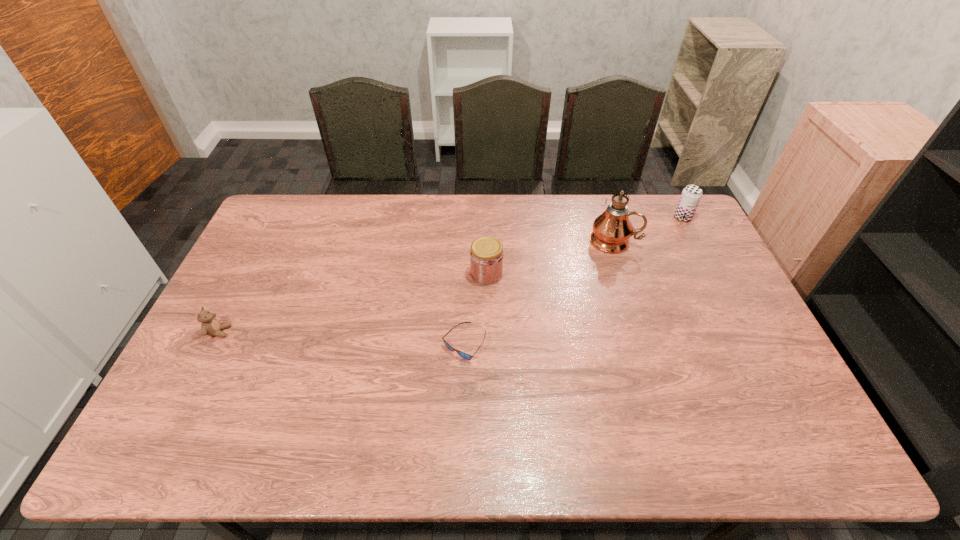
The height and width of the screenshot is (540, 960). Find the location of `vacant space located on the back of the third nearest object`. vacant space located on the back of the third nearest object is located at coordinates (486, 240).

In order to click on free space located on the front-facing side of the leftmost object in this screenshot , I will do `click(289, 332)`.

This screenshot has width=960, height=540. Find the location of `blank space located 0.140m at the front of the shortest object showing the lenses`. blank space located 0.140m at the front of the shortest object showing the lenses is located at coordinates tap(462, 410).

At what (x,y) coordinates should I click in order to perform the action: click on oil lamp situated at the far edge. Please return your answer as a coordinate pair (x, y). The image size is (960, 540). Looking at the image, I should click on tap(612, 229).

Where is `beer can located at the far edge`? The width and height of the screenshot is (960, 540). beer can located at the far edge is located at coordinates (691, 195).

The height and width of the screenshot is (540, 960). Identify the location of object present at the left edge. (210, 326).

Image resolution: width=960 pixels, height=540 pixels. In order to click on object at the right edge in this screenshot , I will do `click(691, 195)`.

Find the location of `object positioned at the far right corner`. object positioned at the far right corner is located at coordinates (691, 195).

Where is `blank space at the far edge`? The width and height of the screenshot is (960, 540). blank space at the far edge is located at coordinates (336, 213).

Locate an element on the screen. vacant space at the near edge is located at coordinates (501, 442).